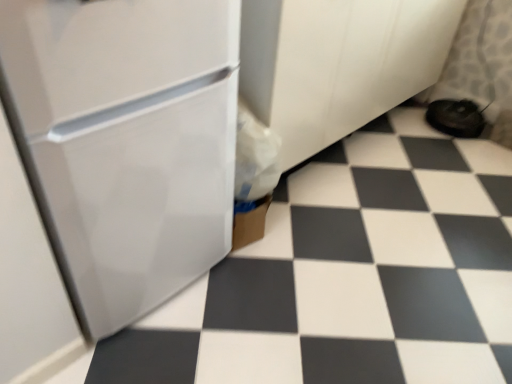
Question: Can you confirm if white glossy tile at center is bigger than black fabric shoe at lower right?

Choices:
 (A) yes
 (B) no

Answer: (A)

Question: Is black fabric shoe at lower right at the back of white glossy tile at center?

Choices:
 (A) yes
 (B) no

Answer: (B)

Question: Can black fabric shoe at lower right be found inside white glossy tile at center?

Choices:
 (A) no
 (B) yes

Answer: (A)

Question: From the image's perspective, would you say white glossy tile at center is shown under black fabric shoe at lower right?

Choices:
 (A) yes
 (B) no

Answer: (A)

Question: From a real-world perspective, is white glossy tile at center below black fabric shoe at lower right?

Choices:
 (A) yes
 (B) no

Answer: (A)

Question: Is white glossy tile at center behind black fabric shoe at lower right?

Choices:
 (A) yes
 (B) no

Answer: (B)

Question: Can you confirm if white glossy refrigerator at left is smaller than black fabric shoe at lower right?

Choices:
 (A) yes
 (B) no

Answer: (B)

Question: Is white glossy refrigerator at left located outside black fabric shoe at lower right?

Choices:
 (A) no
 (B) yes

Answer: (B)

Question: Is white glossy refrigerator at left at the right side of black fabric shoe at lower right?

Choices:
 (A) no
 (B) yes

Answer: (A)

Question: Could you tell me if white glossy refrigerator at left is turned towards black fabric shoe at lower right?

Choices:
 (A) yes
 (B) no

Answer: (B)

Question: Is white glossy refrigerator at left closer to the viewer compared to black fabric shoe at lower right?

Choices:
 (A) no
 (B) yes

Answer: (B)

Question: From a real-world perspective, is white glossy refrigerator at left beneath black fabric shoe at lower right?

Choices:
 (A) no
 (B) yes

Answer: (A)

Question: Considering the relative sizes of white glossy tile at center and white glossy refrigerator at left in the image provided, is white glossy tile at center shorter than white glossy refrigerator at left?

Choices:
 (A) yes
 (B) no

Answer: (A)